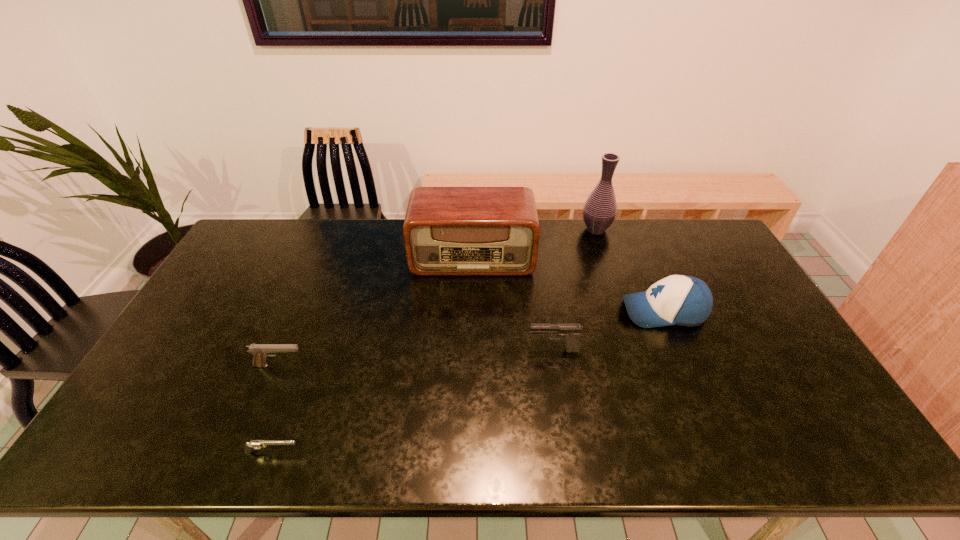
Where is `free space located 0.360m at the barrel of the fifth tallest object`? Image resolution: width=960 pixels, height=540 pixels. free space located 0.360m at the barrel of the fifth tallest object is located at coordinates (438, 366).

Locate an element on the screen. The width and height of the screenshot is (960, 540). free space located on the front-facing side of the shortest object is located at coordinates (335, 452).

The image size is (960, 540). What are the coordinates of `vase that is positioned at the far edge` in the screenshot? It's located at (600, 209).

Image resolution: width=960 pixels, height=540 pixels. I want to click on radio receiver at the far edge, so click(x=447, y=230).

Find the location of a particular element. object that is at the near edge is located at coordinates (253, 444).

Where is `vacant space at the far edge`? The width and height of the screenshot is (960, 540). vacant space at the far edge is located at coordinates (555, 244).

Locate an element on the screen. Image resolution: width=960 pixels, height=540 pixels. vacant space at the near edge is located at coordinates (260, 434).

This screenshot has height=540, width=960. Identify the location of free space at the left edge of the desktop. (265, 273).

Where is `vacant space at the right edge of the desktop`? The width and height of the screenshot is (960, 540). vacant space at the right edge of the desktop is located at coordinates (756, 324).

Find the location of a particular element. The width and height of the screenshot is (960, 540). free space at the far left corner of the desktop is located at coordinates (253, 239).